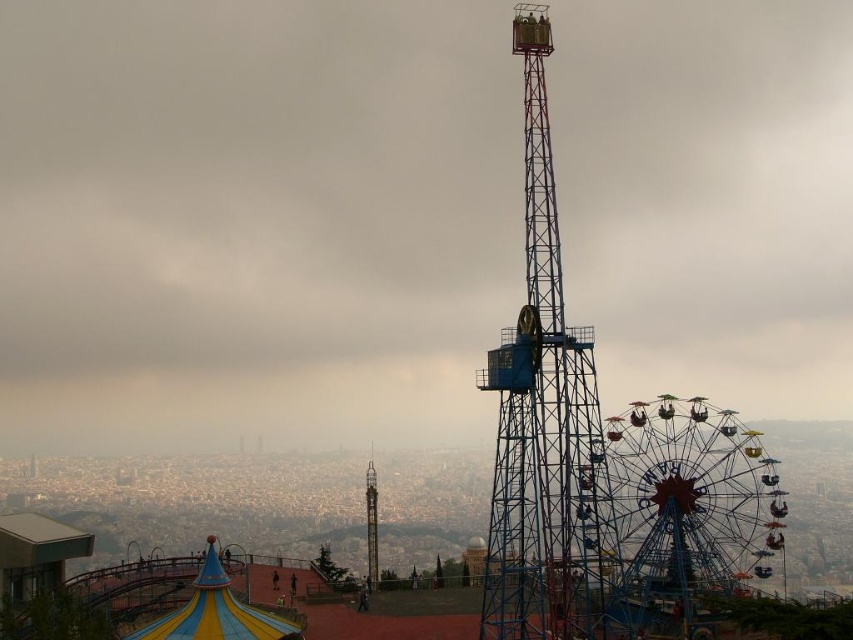
Is metallic ferris wheel at center to the left of metallic blue tower at center from the viewer's perspective?

No, metallic ferris wheel at center is not to the left of metallic blue tower at center.

Is metallic ferris wheel at center bigger than metallic blue tower at center?

Yes.

Locate an element on the screen. This screenshot has width=853, height=640. metallic ferris wheel at center is located at coordinates (199, 500).

The width and height of the screenshot is (853, 640). What are the coordinates of `metallic ferris wheel at center` in the screenshot? It's located at (199, 500).

Which is more to the left, blue metallic tower at center or metallic blue ferris wheel at right?

From the viewer's perspective, blue metallic tower at center appears more on the left side.

Is blue metallic tower at center positioned in front of metallic blue ferris wheel at right?

Yes.

Where is `blue metallic tower at center`? This screenshot has width=853, height=640. blue metallic tower at center is located at coordinates (544, 419).

How much distance is there between metallic ferris wheel at center and blue metallic tower at center?

They are 151.58 feet apart.

Between point (341, 477) and point (579, 577), which one is positioned behind?

The point (341, 477) is behind.

The image size is (853, 640). Identify the location of metallic ferris wheel at center. (199, 500).